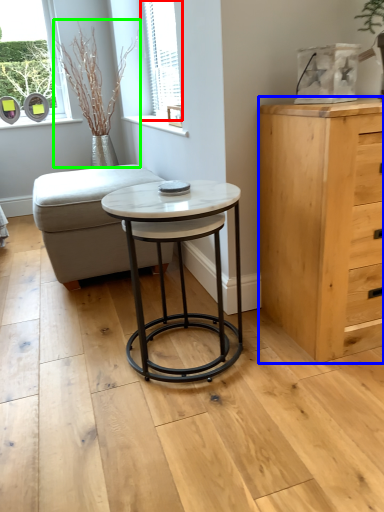
Question: Considering the real-world distances, which object is farthest from window (highlighted by a red box)? chest of drawers (highlighted by a blue box) or plant (highlighted by a green box)?

Choices:
 (A) chest of drawers
 (B) plant

Answer: (A)